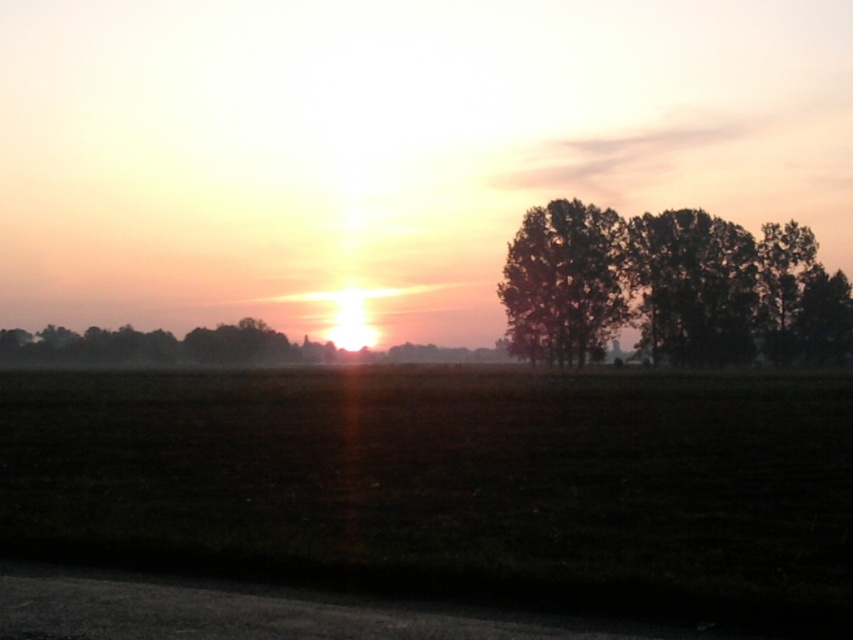
You are standing at the origin point of the image coordinate system. The origin is at the bottom left corner of the image. You want to walk to the dark soil field at center. In which direction should you move?

The dark soil field at center is located at point [451,484]. Since the origin is at the bottom left corner, you should move to the right and slightly upwards to reach it.

You are standing at the edge of the dark soil field at center and want to walk towards the silhouette leafy tree at right. Which direction should you face to move directly towards it?

Since the dark soil field at center is in front of the silhouette leafy tree at right, you should face towards the right direction to walk directly towards the silhouette leafy tree at right.